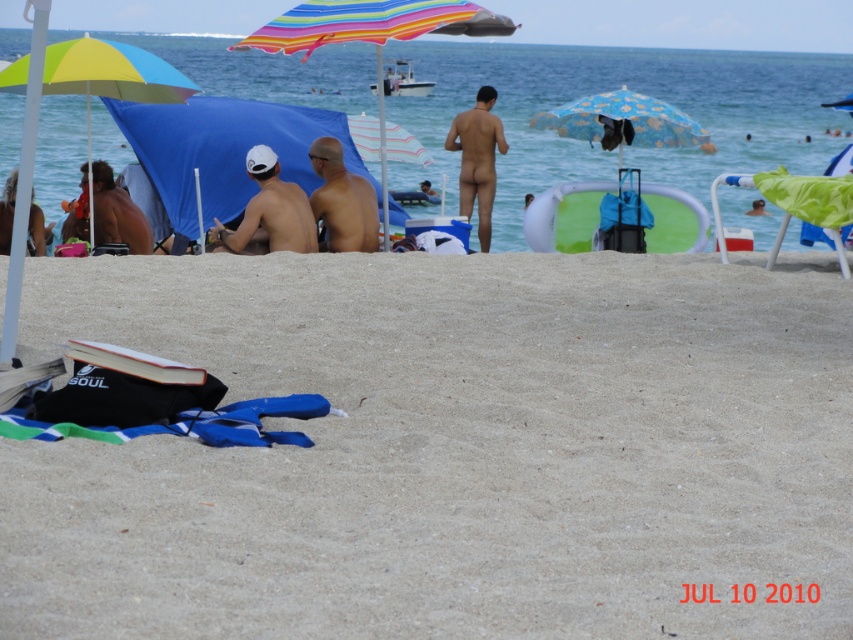
The height and width of the screenshot is (640, 853). What do you see at coordinates (372, 33) in the screenshot? I see `rainbow striped umbrella at center` at bounding box center [372, 33].

Between point (231, 49) and point (322, 211), which one is positioned behind?

Positioned behind is point (322, 211).

The width and height of the screenshot is (853, 640). I want to click on rainbow striped umbrella at center, so click(x=372, y=33).

Between beige sand at lower center and green fabric beach chair at right, which one appears on the right side from the viewer's perspective?

Positioned to the right is green fabric beach chair at right.

Does beige sand at lower center have a lesser height compared to green fabric beach chair at right?

Yes.

The image size is (853, 640). What do you see at coordinates (450, 451) in the screenshot?
I see `beige sand at lower center` at bounding box center [450, 451].

In order to click on beige sand at lower center in this screenshot , I will do `click(450, 451)`.

Measure the distance between green fabric beach chair at right and camera.

10.81 meters

Where is `green fabric beach chair at right`? The height and width of the screenshot is (640, 853). green fabric beach chair at right is located at coordinates (795, 204).